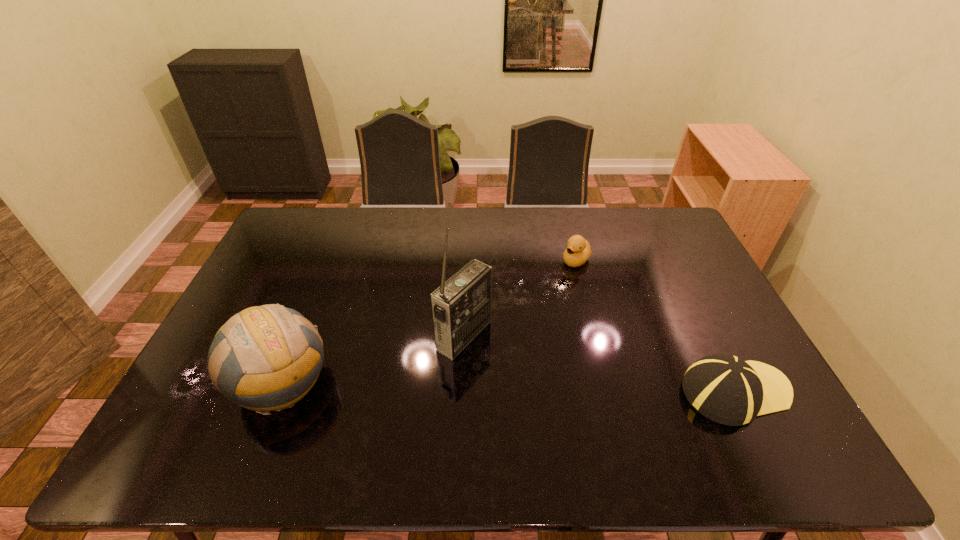
This screenshot has height=540, width=960. Find the location of `vacant region between the rightmost object and the tallest object`. vacant region between the rightmost object and the tallest object is located at coordinates (600, 363).

I want to click on free space between the radio receiver and the baseball cap, so click(600, 363).

At what (x,y) coordinates should I click in order to perform the action: click on free space between the third object from left to right and the leftmost object. Please return your answer as a coordinate pair (x, y). The width and height of the screenshot is (960, 540). Looking at the image, I should click on (429, 322).

Find the location of a particular element. free space between the third shortest object and the farthest object is located at coordinates (x=429, y=322).

Select which object is the second closest to the farthest object. Please provide its 2D coordinates. Your answer should be formatted as a tuple, i.e. [(x, y)], where the tuple contains the x and y coordinates of a point satisfying the conditions above.

[(724, 388)]

Locate which object is the closest to the rightmost object. Please provide its 2D coordinates. Your answer should be formatted as a tuple, i.e. [(x, y)], where the tuple contains the x and y coordinates of a point satisfying the conditions above.

[(578, 251)]

This screenshot has height=540, width=960. In order to click on vacant area in the image that satisfies the following two spatial constraints: 1. on the back side of the third object from left to right; 2. on the right side of the volleyball in this screenshot , I will do `click(330, 260)`.